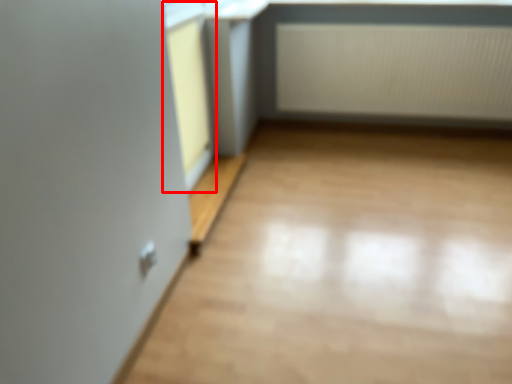
Question: From the image's perspective, where is window frame (annotated by the red box) located relative to radiator?

Choices:
 (A) below
 (B) above

Answer: (A)